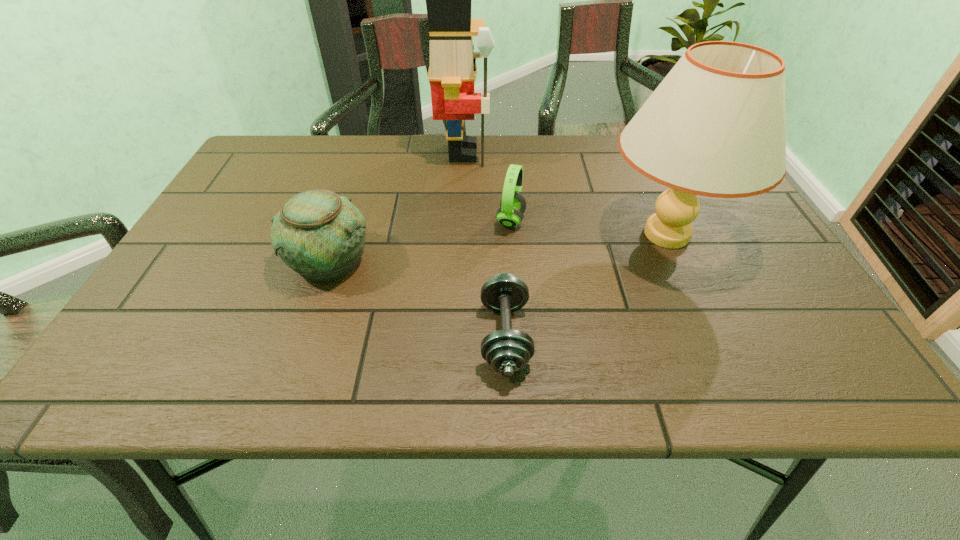
I want to click on nutcracker, so click(x=452, y=71).

The width and height of the screenshot is (960, 540). Find the location of `lampshade`. lampshade is located at coordinates (715, 126).

Image resolution: width=960 pixels, height=540 pixels. Identify the location of the leftmost object. (321, 235).

Find the location of a particular element. headset is located at coordinates (512, 206).

In order to click on dumbbell in this screenshot , I will do (x=507, y=351).

Find the location of `vacant space located in front of the farthest object holding the staff`. vacant space located in front of the farthest object holding the staff is located at coordinates (599, 152).

You are a GUI agent. You are given a task and a screenshot of the screen. Output one action in this format:
    pyautogui.click(x=<x>, y=<y>)
    Task: Click on the vacant region located on the back of the rightmost object
    This screenshot has height=540, width=960.
    Given the screenshot: What is the action you would take?
    pyautogui.click(x=630, y=152)

The height and width of the screenshot is (540, 960). Find the location of `free location located 0.160m on the right of the leftmost object`. free location located 0.160m on the right of the leftmost object is located at coordinates (445, 260).

The width and height of the screenshot is (960, 540). Identify the location of free location located on the left of the headset. (442, 220).

I want to click on free space located on the left of the shortest object, so click(x=432, y=336).